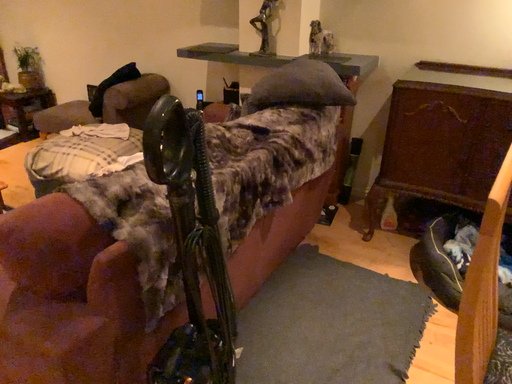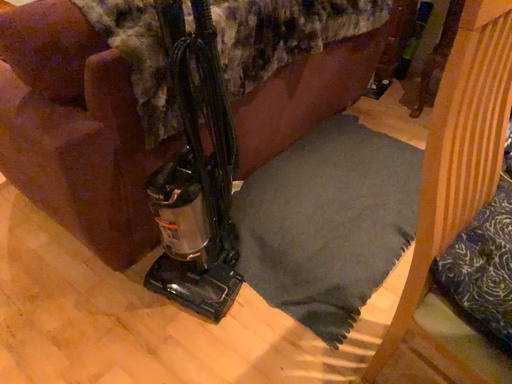
Question: How did the camera likely rotate when shooting the video?

Choices:
 (A) rotated right
 (B) rotated left

Answer: (B)